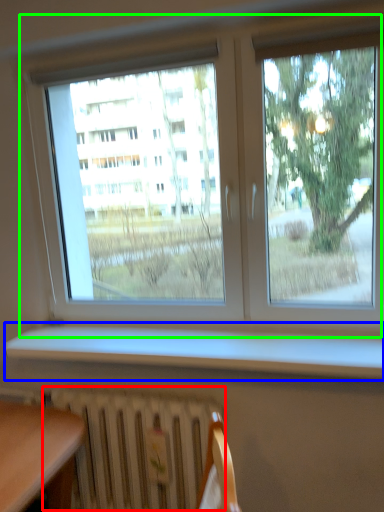
Question: Based on their relative distances, which object is farther from radiator (highlighted by a red box)? Choose from window sill (highlighted by a blue box) and window (highlighted by a green box).

Choices:
 (A) window sill
 (B) window

Answer: (B)